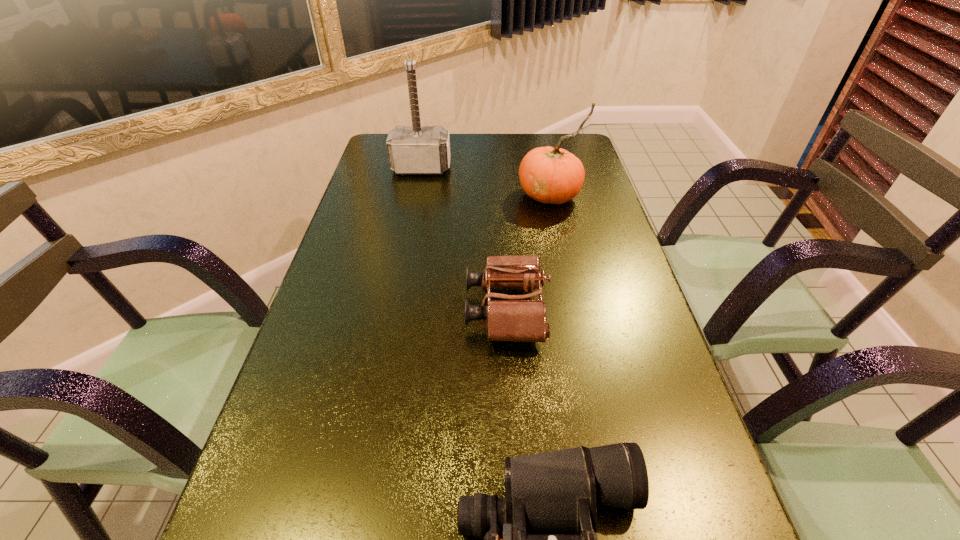
Where is `vacant area in the image that satisfies the following two spatial constraints: 1. for striking with the head of the tallest object; 2. on the right side of the third shortest object`? vacant area in the image that satisfies the following two spatial constraints: 1. for striking with the head of the tallest object; 2. on the right side of the third shortest object is located at coordinates (x=416, y=195).

The width and height of the screenshot is (960, 540). I want to click on free point that satisfies the following two spatial constraints: 1. for striking with the head of the hammer; 2. on the left side of the pumpkin, so click(416, 195).